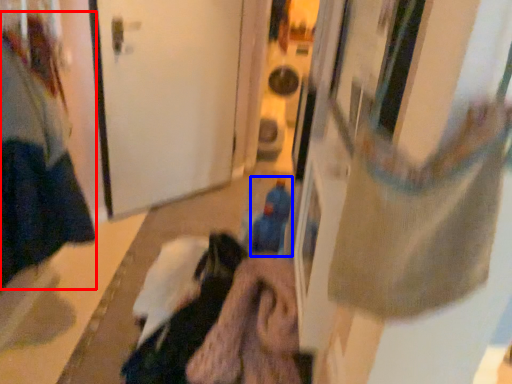
Question: Which of the following is the farthest to the observer, woman (highlighted by a red box) or toy (highlighted by a blue box)?

Choices:
 (A) woman
 (B) toy

Answer: (B)